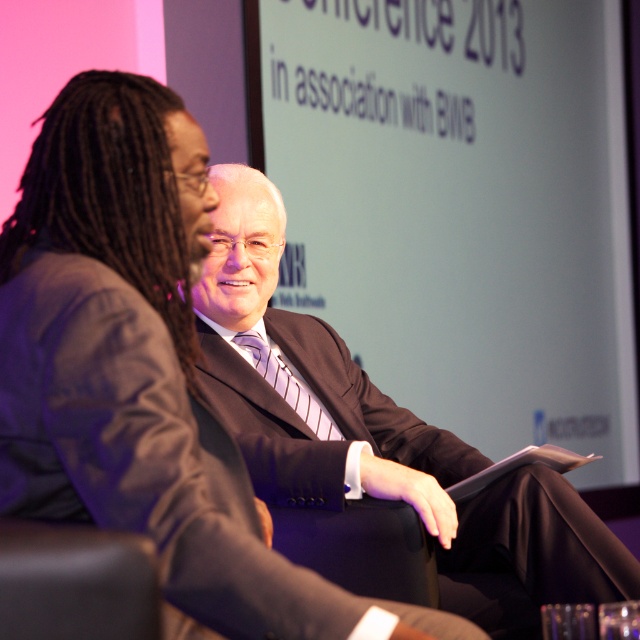
Is point (244, 577) less distant than point (80, 612)?

No, (244, 577) is further to viewer.

Is matte black suit at left thinner than black leather chair at lower left?

In fact, matte black suit at left might be wider than black leather chair at lower left.

What do you see at coordinates (141, 369) in the screenshot? The width and height of the screenshot is (640, 640). I see `matte black suit at left` at bounding box center [141, 369].

Where is `matte black suit at left`? matte black suit at left is located at coordinates pos(141,369).

Measure the distance from matte black suit at center to black leather chair at lower left.

matte black suit at center and black leather chair at lower left are 1.15 meters apart.

Describe the element at coordinates (378, 436) in the screenshot. I see `matte black suit at center` at that location.

Who is more forward, [250,413] or [65,577]?

Point [65,577]

Find the location of a particular element. matte black suit at center is located at coordinates (378, 436).

Who is positioned more to the right, matte black suit at left or matte black suit at center?

matte black suit at center

Does matte black suit at left have a larger size compared to matte black suit at center?

No, matte black suit at left is not bigger than matte black suit at center.

Image resolution: width=640 pixels, height=640 pixels. In order to click on matte black suit at left in this screenshot , I will do `click(141, 369)`.